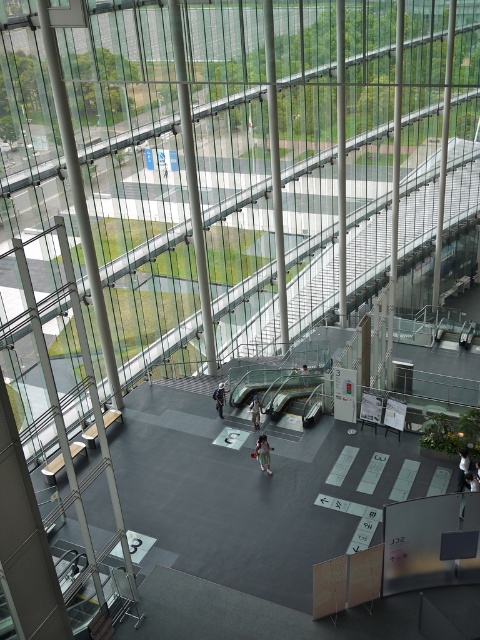
You are a visitor at this public building and want to know which item takes up more space horizontally between the light brown fabric pants at center and the light blue fabric jacket at center. Which one is wider?

The light brown fabric pants at center is wider than the light blue fabric jacket at center according to the description.

You are a visitor in this public building and notice a person wearing a white fabric shirt at center and dark blue jeans at center. Which piece of clothing is wider?

The white fabric shirt at center has a lesser width compared to dark blue jeans at center, so the dark blue jeans at center are wider.

You are standing in the central area of the public building and see the point marked at coordinates (x=263, y=452). What object is located at that point?

The point at coordinates (x=263, y=452) indicates the location of the light brown fabric pants at center.